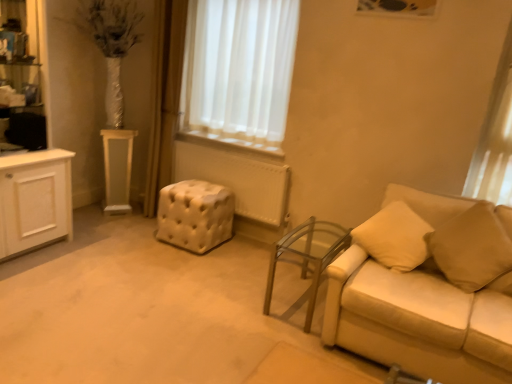
Question: Considering the relative sizes of beige fabric pillow at right and transparent glass table at lower right, the second table from the back, in the image provided, is beige fabric pillow at right taller than transparent glass table at lower right, the second table from the back,?

Choices:
 (A) no
 (B) yes

Answer: (B)

Question: Does beige fabric pillow at right have a smaller size compared to transparent glass table at lower right, marked as the second table in a left-to-right arrangement?

Choices:
 (A) no
 (B) yes

Answer: (B)

Question: Does beige fabric pillow at right appear on the right side of transparent glass table at lower right, the 1th table from the right?

Choices:
 (A) yes
 (B) no

Answer: (A)

Question: From the image's perspective, is beige fabric pillow at right over transparent glass table at lower right, which ranks as the 1th table in front-to-back order?

Choices:
 (A) no
 (B) yes

Answer: (B)

Question: Is beige fabric pillow at right facing towards transparent glass table at lower right, the second table from the back?

Choices:
 (A) yes
 (B) no

Answer: (B)

Question: Looking at their shapes, would you say beige leather couch at right is wider or thinner than white tufted ottoman at center?

Choices:
 (A) thin
 (B) wide

Answer: (B)

Question: Is beige leather couch at right bigger or smaller than white tufted ottoman at center?

Choices:
 (A) big
 (B) small

Answer: (A)

Question: Considering the positions of point (484, 359) and point (176, 201), is point (484, 359) closer or farther from the camera than point (176, 201)?

Choices:
 (A) closer
 (B) farther

Answer: (A)

Question: Is beige leather couch at right taller or shorter than white tufted ottoman at center?

Choices:
 (A) tall
 (B) short

Answer: (A)

Question: Would you say white tufted ottoman at center is inside or outside white glossy pedestal at left, which ranks as the 2th table in front-to-back order?

Choices:
 (A) inside
 (B) outside

Answer: (B)

Question: Considering the positions of white tufted ottoman at center and white glossy pedestal at left, placed as the 2th table when sorted from bottom to top, in the image, is white tufted ottoman at center bigger or smaller than white glossy pedestal at left, placed as the 2th table when sorted from bottom to top,?

Choices:
 (A) small
 (B) big

Answer: (B)

Question: Considering the positions of white tufted ottoman at center and white glossy pedestal at left, the first table positioned from the back, in the image, is white tufted ottoman at center wider or thinner than white glossy pedestal at left, the first table positioned from the back,?

Choices:
 (A) wide
 (B) thin

Answer: (A)

Question: Is point (181, 225) closer or farther from the camera than point (114, 132)?

Choices:
 (A) closer
 (B) farther

Answer: (A)

Question: Looking at their shapes, would you say beige fabric pillow at right is wider or thinner than white tufted ottoman at center?

Choices:
 (A) thin
 (B) wide

Answer: (A)

Question: Considering their positions, is beige fabric pillow at right located in front of or behind white tufted ottoman at center?

Choices:
 (A) front
 (B) behind

Answer: (A)